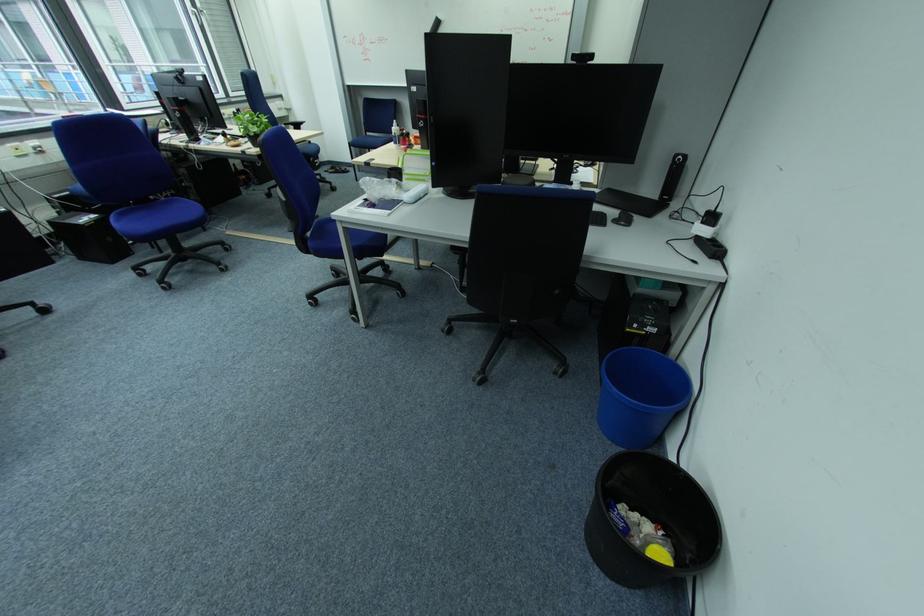
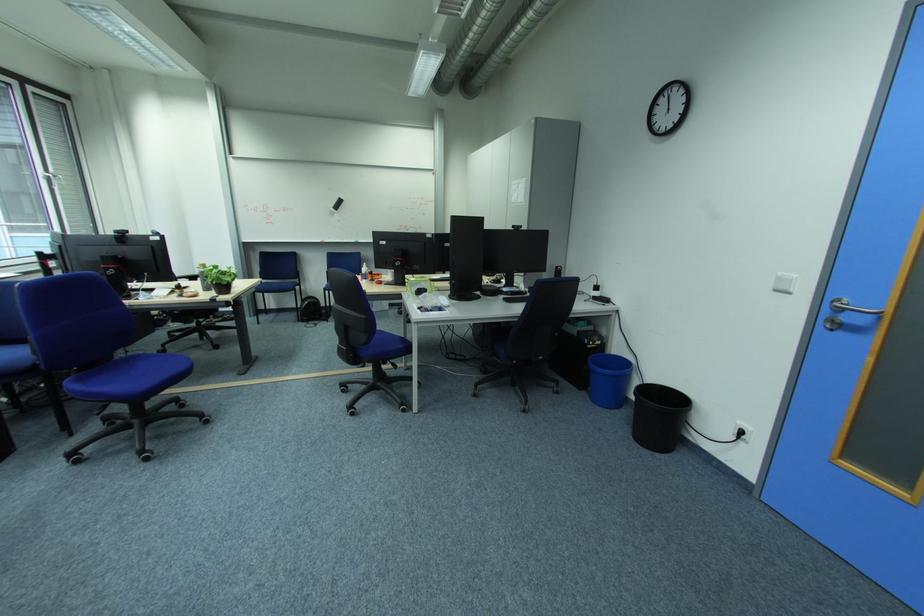
Locate, in the second image, the point that corresponds to [596,514] in the first image.

(640, 439)